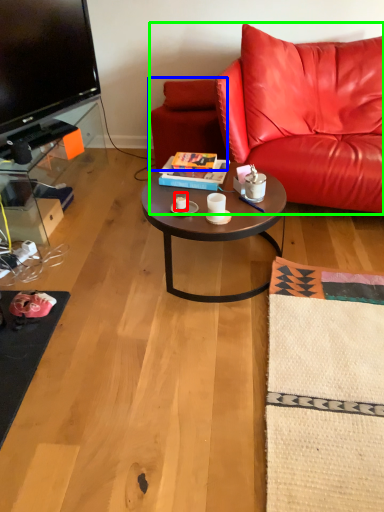
Question: Based on their relative distances, which object is farther from coffee cup (highlighted by a red box)? Choose from swivel chair (highlighted by a blue box) and studio couch (highlighted by a green box).

Choices:
 (A) swivel chair
 (B) studio couch

Answer: (B)